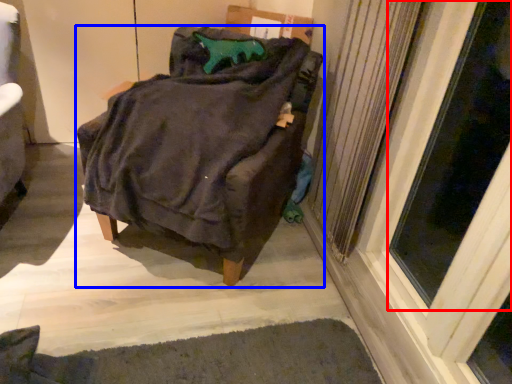
Question: Which object appears farthest to the camera in this image, screen door (highlighted by a red box) or furniture (highlighted by a blue box)?

Choices:
 (A) screen door
 (B) furniture

Answer: (B)